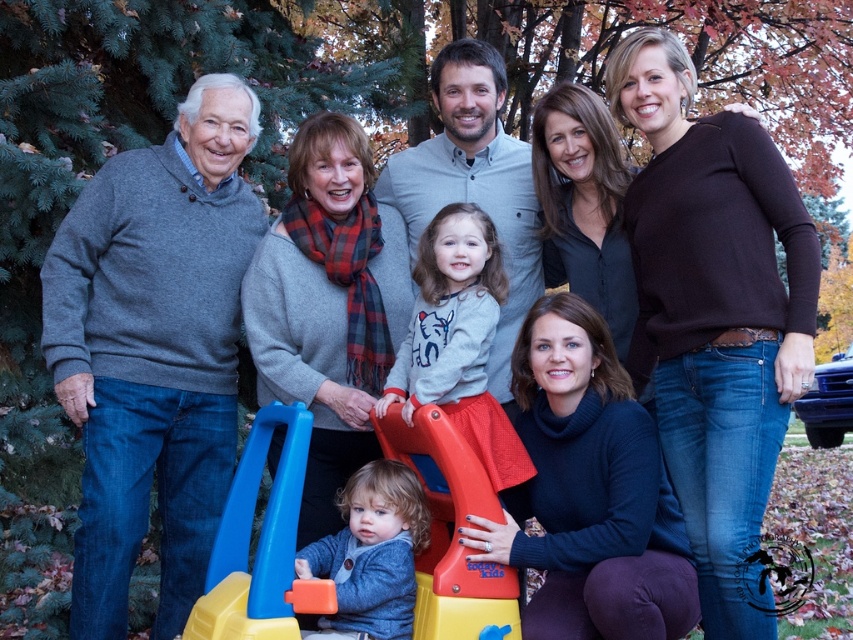
Question: Which of the following is the closest to the observer?

Choices:
 (A) gray sweater at left
 (B) blue plastic toy at center
 (C) blue plastic toy at lower left
 (D) soft gray sweater at center

Answer: (C)

Question: Does gray sweater at left have a greater width compared to blue plastic toy at lower left?

Choices:
 (A) no
 (B) yes

Answer: (B)

Question: Which of the following is the farthest from the observer?

Choices:
 (A) soft gray sweater at center
 (B) red plastic slide at lower center

Answer: (A)

Question: Can you confirm if gray fleece sweatshirt at center is positioned to the right of red plastic slide at lower center?

Choices:
 (A) no
 (B) yes

Answer: (B)

Question: Where is blue plastic toy at center located in relation to blue plastic toy at lower left in the image?

Choices:
 (A) right
 (B) left

Answer: (A)

Question: Which object is the farthest from the gray fleece sweatshirt at center?

Choices:
 (A) soft gray sweater at center
 (B) red plastic slide at lower center
 (C) blue plastic toy at center

Answer: (C)